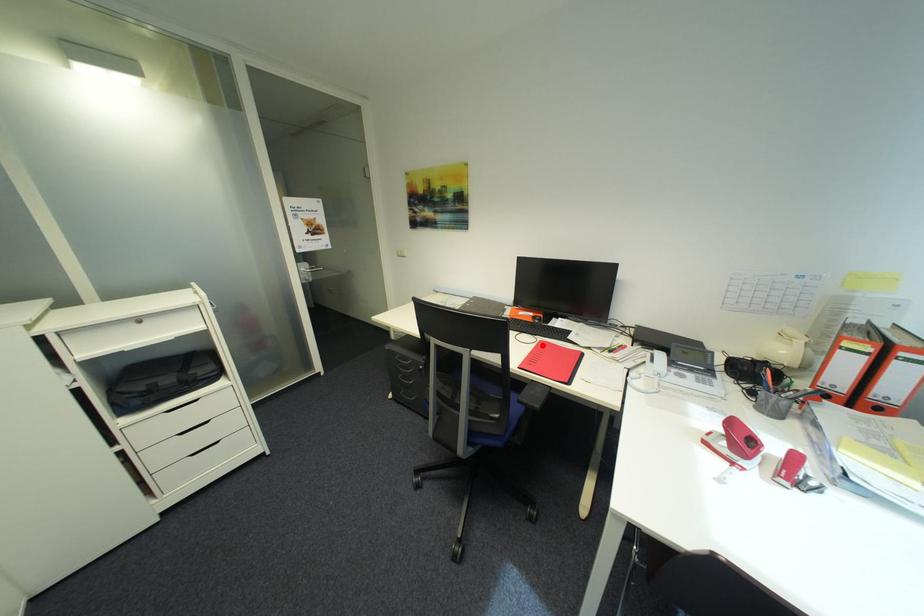
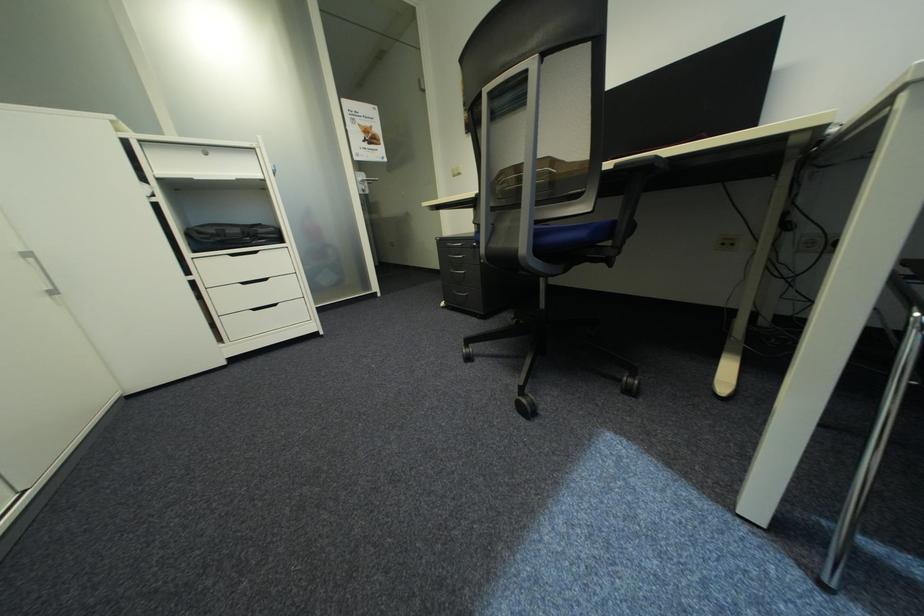
Question: I am providing you with two images of the same scene from different viewpoints. A red point is marked on the first image. Is the red point's position out of view in image 2?

Choices:
 (A) Yes
 (B) No

Answer: (A)